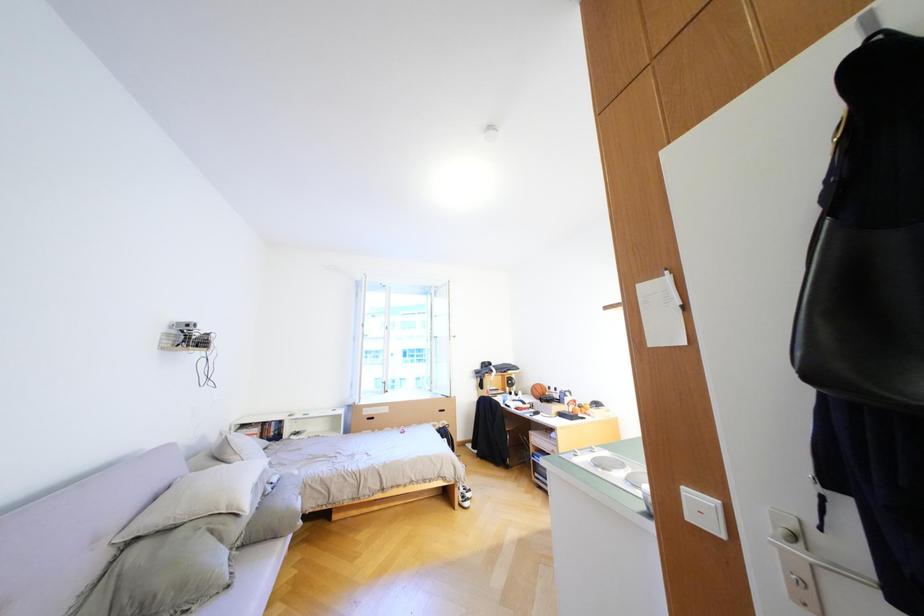
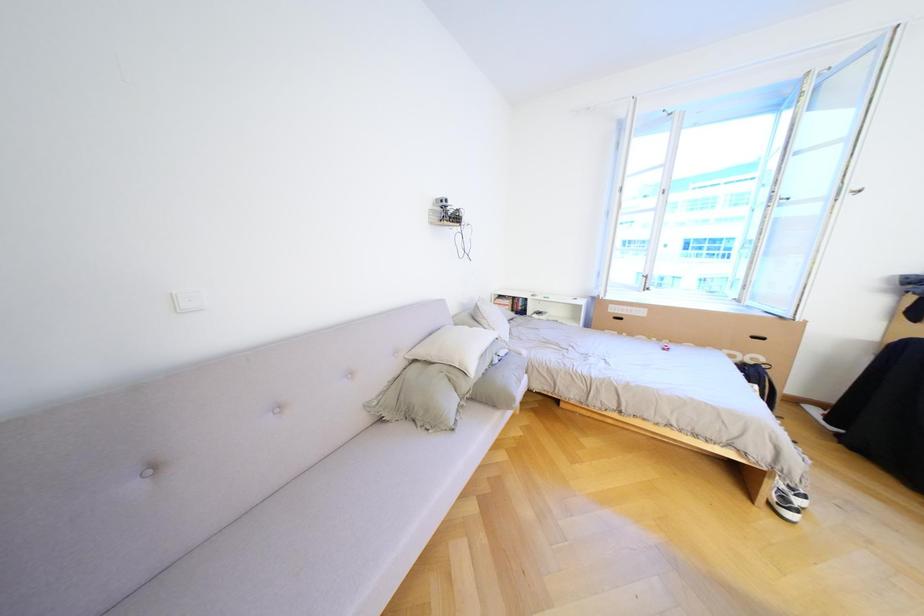
Based on the continuous images, in which direction is the camera rotating?

The camera's rotation is toward left-down.